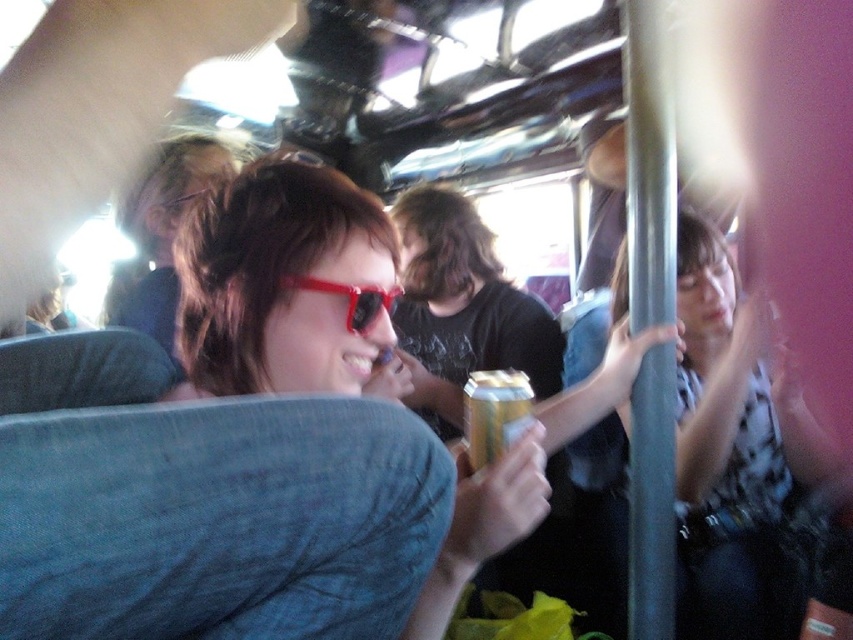
Question: Which object is closer to the camera taking this photo?

Choices:
 (A) transparent plastic sunglasses at center
 (B) gold foil can at center

Answer: (A)

Question: Is gold foil can at center below transparent plastic sunglasses at center?

Choices:
 (A) yes
 (B) no

Answer: (A)

Question: Observing the image, what is the correct spatial positioning of gold foil can at center in reference to transparent plastic sunglasses at center?

Choices:
 (A) left
 (B) right

Answer: (B)

Question: Is gold foil can at center to the right of transparent plastic sunglasses at center from the viewer's perspective?

Choices:
 (A) no
 (B) yes

Answer: (B)

Question: Which point appears farthest from the camera in this image?

Choices:
 (A) (474, 394)
 (B) (372, 308)

Answer: (A)